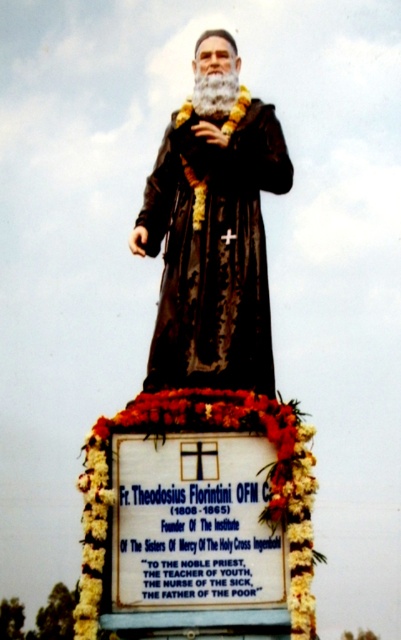
Who is positioned more to the right, black matte statue at center or floral garland at bottom?

black matte statue at center

Identify the location of black matte statue at center. The image size is (401, 640). (204, 397).

Between point (218, 598) and point (309, 451), which one is positioned in front?

Point (218, 598) is in front.

Where is `black matte statue at center`? This screenshot has width=401, height=640. black matte statue at center is located at coordinates (204, 397).

Is matte black robe at center further to the viewer compared to floral garland at bottom?

Yes.

Between point (214, 323) and point (283, 483), which one is positioned in front?

Point (283, 483)

Is point (263, 323) closer to viewer compared to point (281, 465)?

No, it is behind (281, 465).

The height and width of the screenshot is (640, 401). I want to click on matte black robe at center, so (214, 250).

Who is positioned more to the left, black matte statue at center or matte black robe at center?

From the viewer's perspective, matte black robe at center appears more on the left side.

Is black matte statue at center bigger than matte black robe at center?

Yes, black matte statue at center is bigger than matte black robe at center.

Is point (178, 289) positioned behind point (172, 356)?

Yes, it is.

Identify the location of black matte statue at center. The width and height of the screenshot is (401, 640). (204, 397).